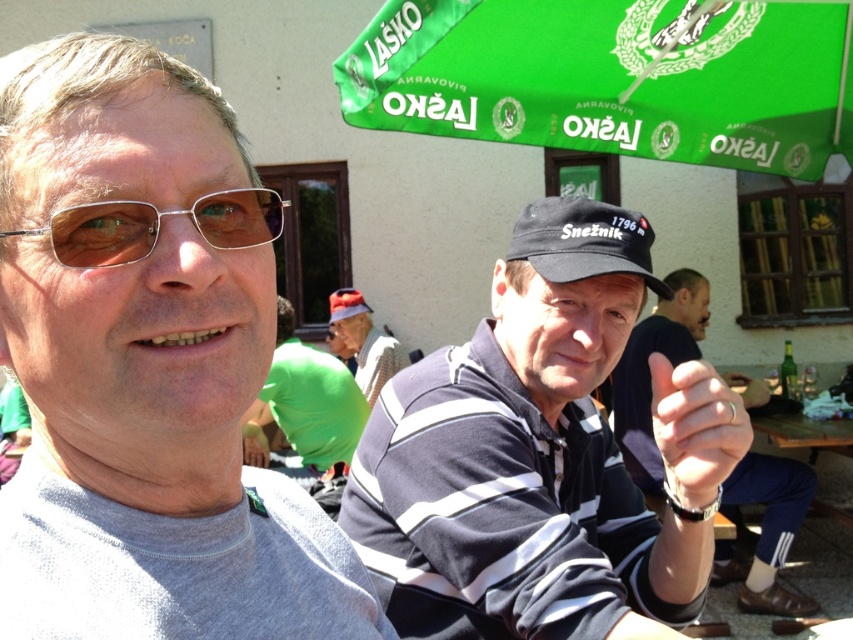
Is gray matte shirt at left closer to the viewer compared to plaid fabric shirt at center?

Yes, it is in front of plaid fabric shirt at center.

Does point (177, 163) come farther from viewer compared to point (334, 308)?

No, (177, 163) is in front of (334, 308).

You are a GUI agent. You are given a task and a screenshot of the screen. Output one action in this format:
    pyautogui.click(x=<x>, y=<y>)
    Task: Click on the gray matte shirt at left
    
    Given the screenshot: What is the action you would take?
    pyautogui.click(x=146, y=365)

Is point (144, 380) farther from viewer compared to point (699, 276)?

No, it is not.

Which is more to the right, gray matte shirt at left or black fabric cap at center?

black fabric cap at center is more to the right.

Who is more distant from viewer, (x=273, y=477) or (x=721, y=580)?

The point (x=721, y=580) is behind.

Identify the location of gray matte shirt at left. This screenshot has width=853, height=640. (146, 365).

Is black matte cap at center positioned in front of plaid fabric shirt at center?

Yes, black matte cap at center is closer to the viewer.

Can you confirm if black matte cap at center is positioned below plaid fabric shirt at center?

Yes, black matte cap at center is below plaid fabric shirt at center.

Locate an element on the screen. Image resolution: width=853 pixels, height=640 pixels. black matte cap at center is located at coordinates (541, 456).